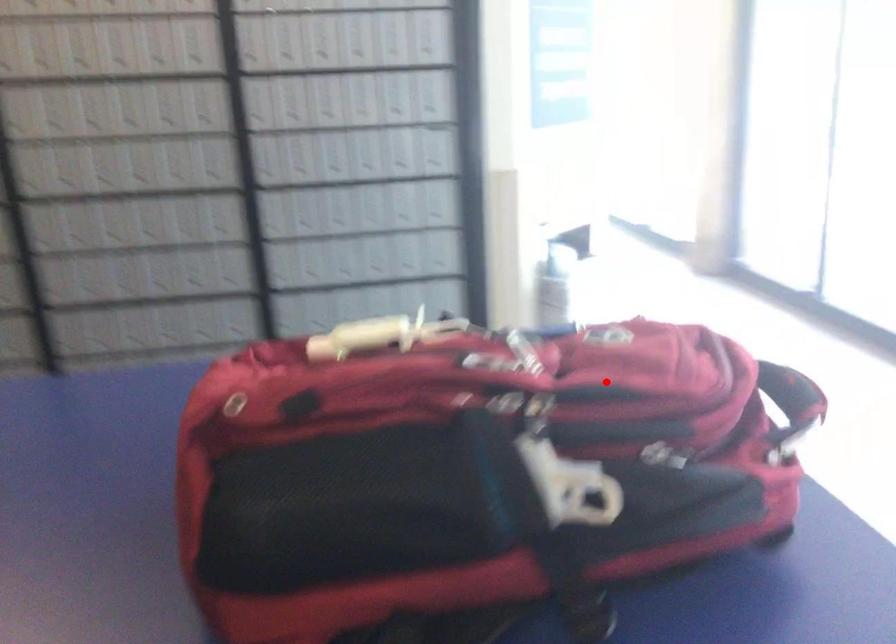
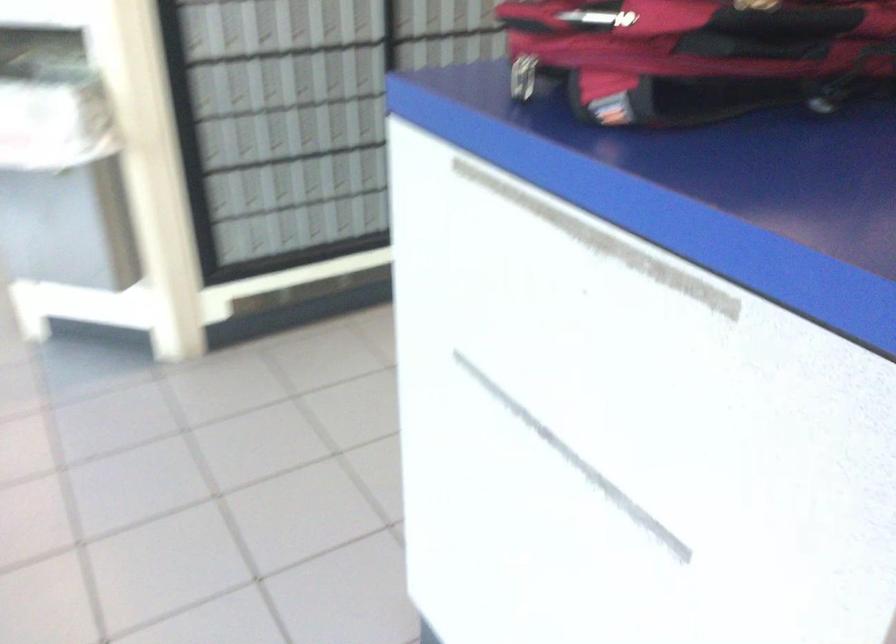
Find the pixel in the second image that matches the highlighted location in the first image.

(696, 55)